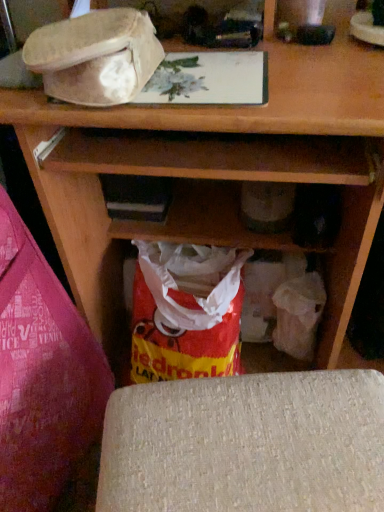
Question: Considering the relative sizes of red plastic bag at lower left and textured beige cushion at lower center in the image provided, is red plastic bag at lower left bigger than textured beige cushion at lower center?

Choices:
 (A) yes
 (B) no

Answer: (A)

Question: Does red plastic bag at lower left lie behind textured beige cushion at lower center?

Choices:
 (A) yes
 (B) no

Answer: (B)

Question: Is textured beige cushion at lower center a part of red plastic bag at lower left?

Choices:
 (A) yes
 (B) no

Answer: (B)

Question: From the image's perspective, is red plastic bag at lower left located above textured beige cushion at lower center?

Choices:
 (A) no
 (B) yes

Answer: (B)

Question: Does red plastic bag at lower left turn towards textured beige cushion at lower center?

Choices:
 (A) yes
 (B) no

Answer: (A)

Question: Is fuzzy beige hat at upper left wider or thinner than textured beige cushion at lower center?

Choices:
 (A) thin
 (B) wide

Answer: (B)

Question: Based on their positions, is fuzzy beige hat at upper left located to the left or right of textured beige cushion at lower center?

Choices:
 (A) right
 (B) left

Answer: (B)

Question: Relative to textured beige cushion at lower center, is fuzzy beige hat at upper left in front or behind?

Choices:
 (A) front
 (B) behind

Answer: (B)

Question: Do you think fuzzy beige hat at upper left is within textured beige cushion at lower center, or outside of it?

Choices:
 (A) inside
 (B) outside

Answer: (B)

Question: Is fuzzy beige hat at upper left in front of or behind red plastic bag at lower left in the image?

Choices:
 (A) behind
 (B) front

Answer: (A)

Question: Considering the positions of fuzzy beige hat at upper left and red plastic bag at lower left in the image, is fuzzy beige hat at upper left taller or shorter than red plastic bag at lower left?

Choices:
 (A) tall
 (B) short

Answer: (B)

Question: Looking at the image, does fuzzy beige hat at upper left seem bigger or smaller compared to red plastic bag at lower left?

Choices:
 (A) big
 (B) small

Answer: (B)

Question: Does point (115, 83) appear closer or farther from the camera than point (82, 362)?

Choices:
 (A) farther
 (B) closer

Answer: (B)

Question: From the image's perspective, is fuzzy beige hat at upper left located above or below red plastic grocery bag at lower center?

Choices:
 (A) above
 (B) below

Answer: (A)

Question: In the image, is fuzzy beige hat at upper left on the left side or the right side of red plastic grocery bag at lower center?

Choices:
 (A) right
 (B) left

Answer: (B)